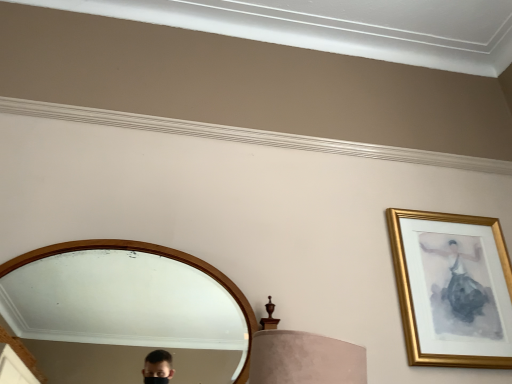
Question: Should I look upward or downward to see gold framed picture at upper right?

Choices:
 (A) down
 (B) up

Answer: (A)

Question: From a real-world perspective, is wooden mirror at center located higher than gold framed picture at upper right?

Choices:
 (A) yes
 (B) no

Answer: (B)

Question: Considering the relative positions of wooden mirror at center and gold framed picture at upper right in the image provided, is wooden mirror at center to the left of gold framed picture at upper right from the viewer's perspective?

Choices:
 (A) yes
 (B) no

Answer: (A)

Question: Would you say wooden mirror at center contains gold framed picture at upper right?

Choices:
 (A) no
 (B) yes

Answer: (A)

Question: Is wooden mirror at center positioned before gold framed picture at upper right?

Choices:
 (A) no
 (B) yes

Answer: (B)

Question: Considering the relative sizes of wooden mirror at center and gold framed picture at upper right in the image provided, is wooden mirror at center thinner than gold framed picture at upper right?

Choices:
 (A) yes
 (B) no

Answer: (B)

Question: Is wooden mirror at center outside of gold framed picture at upper right?

Choices:
 (A) no
 (B) yes

Answer: (B)

Question: From the image's perspective, is gold framed picture at upper right located beneath wooden mirror at center?

Choices:
 (A) yes
 (B) no

Answer: (B)

Question: Can you confirm if gold framed picture at upper right is smaller than wooden mirror at center?

Choices:
 (A) no
 (B) yes

Answer: (B)

Question: Does gold framed picture at upper right lie behind wooden mirror at center?

Choices:
 (A) no
 (B) yes

Answer: (B)

Question: Is gold framed picture at upper right outside wooden mirror at center?

Choices:
 (A) yes
 (B) no

Answer: (A)

Question: Can you confirm if gold framed picture at upper right is positioned to the left of wooden mirror at center?

Choices:
 (A) yes
 (B) no

Answer: (B)

Question: Is gold framed picture at upper right bigger than wooden mirror at center?

Choices:
 (A) no
 (B) yes

Answer: (A)

Question: Is gold framed picture at upper right taller or shorter than wooden mirror at center?

Choices:
 (A) tall
 (B) short

Answer: (A)